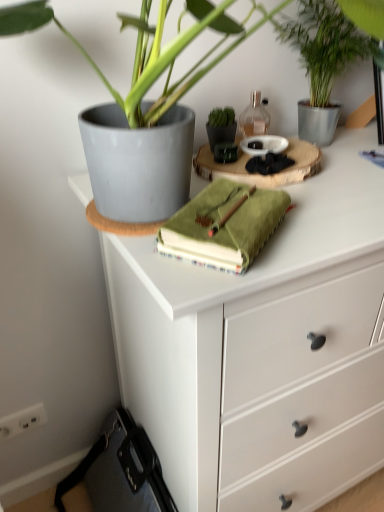
Question: Is translucent glass bottle at upper center inside or outside of white matte chest of drawers at upper center?

Choices:
 (A) inside
 (B) outside

Answer: (B)

Question: From a real-world perspective, relative to white matte chest of drawers at upper center, is translucent glass bottle at upper center vertically above or below?

Choices:
 (A) below
 (B) above

Answer: (B)

Question: Considering the real-world distances, which object is closest to the translucent glass bottle at upper center?

Choices:
 (A) green leafy plant at upper right
 (B) white matte chest of drawers at upper center
 (C) green suede journal at center
 (D) green matte flowerpot at center

Answer: (D)

Question: Which object is the farthest from the green leafy plant at upper right?

Choices:
 (A) green suede journal at center
 (B) green matte flowerpot at center
 (C) translucent glass bottle at upper center
 (D) white matte chest of drawers at upper center

Answer: (D)